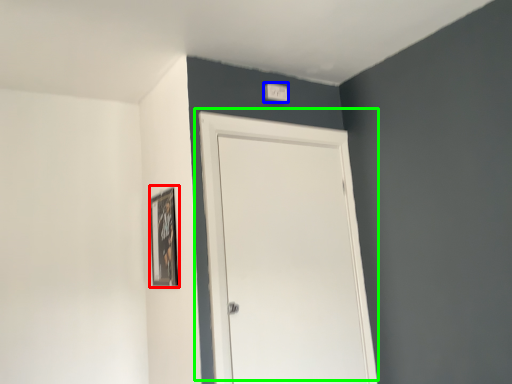
Question: Considering the real-world distances, which object is farthest from picture frame (highlighted by a red box)? light switch (highlighted by a blue box) or door (highlighted by a green box)?

Choices:
 (A) light switch
 (B) door

Answer: (A)